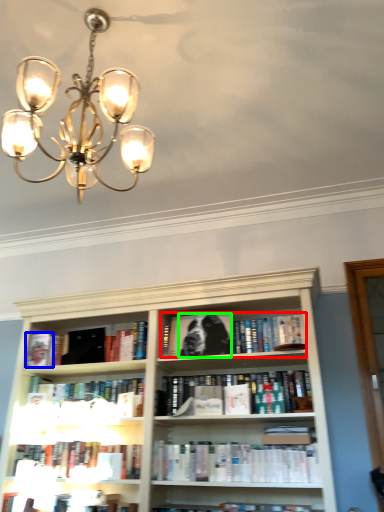
Question: Which object is positioned farthest from book (highlighted by a red box)? Select from paperback book (highlighted by a blue box) and dog (highlighted by a green box).

Choices:
 (A) paperback book
 (B) dog

Answer: (A)